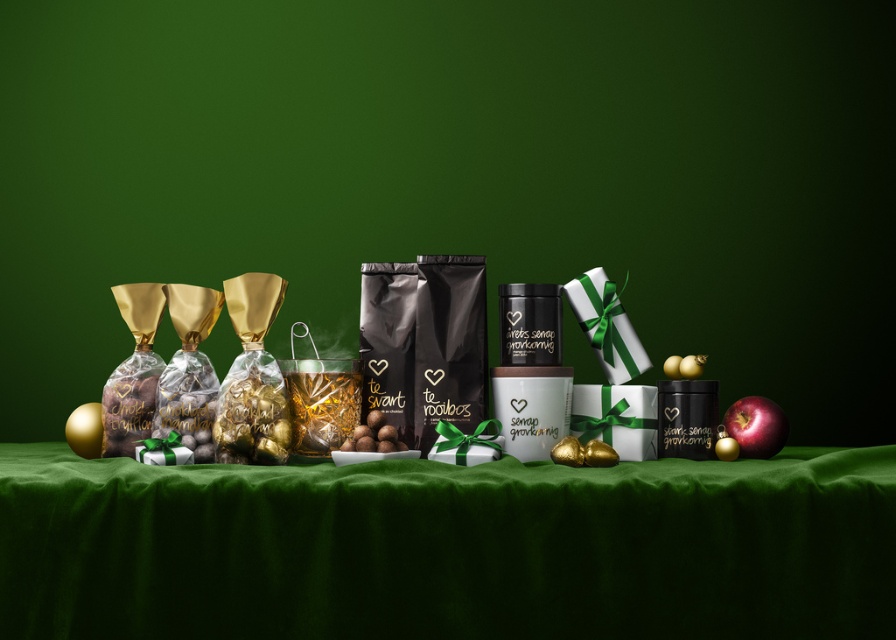
You are organizing a holiday gift table and see the green velvet tablecloth at center and the red glossy apple at right. Which item is located to the left of the other?

The green velvet tablecloth at center is positioned on the left side of red glossy apple at right.

You are standing 1.5 meters away from the green matte backdrop at center. Can you reach it without moving your feet?

The green matte backdrop at center is 1.17 meters from the camera, so if you are standing 1.5 meters away, you are 0.33 meters too far to reach it without moving your feet.

You are setting up a holiday display and need to place a 20 inch wide decorative item between the green matte backdrop at center and the green velvet tablecloth at center. Will there be enough space?

The distance between the green matte backdrop at center and the green velvet tablecloth at center is 20.42 inches. Since the decorative item is 20 inches wide, there is enough space as 20.42 inches is slightly larger than 20 inches.